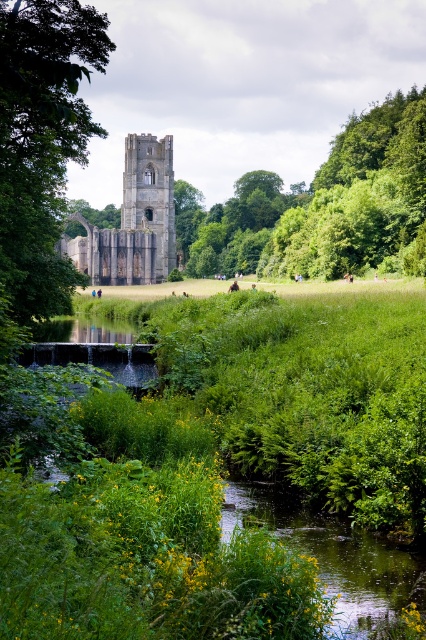
You are a photographer planning to capture the green leafy tree at center and the dark gray stone tower at center in a single frame. Based on their sizes, which object would appear more prominent in the photo?

The green leafy tree at center would appear more prominent in the photo since it is larger in size than the dark gray stone tower at center.

You are standing in the serene landscape and want to walk from the point closer to you to the point further away. Which path would you take between the two points, point (25,60) and point (245,515)?

You should take the path leading towards point (245,515) because it is further away from you compared to point (25,60), which is closer.